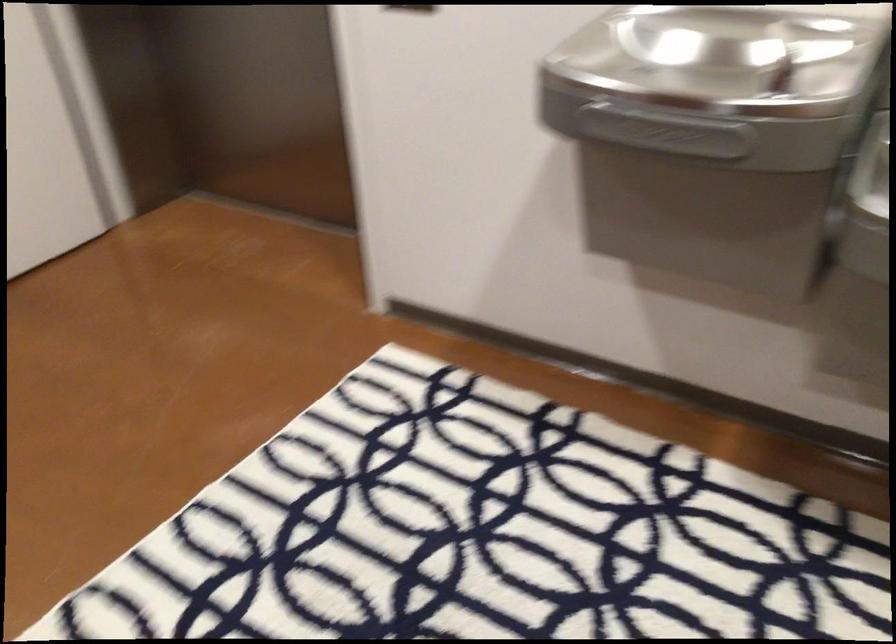
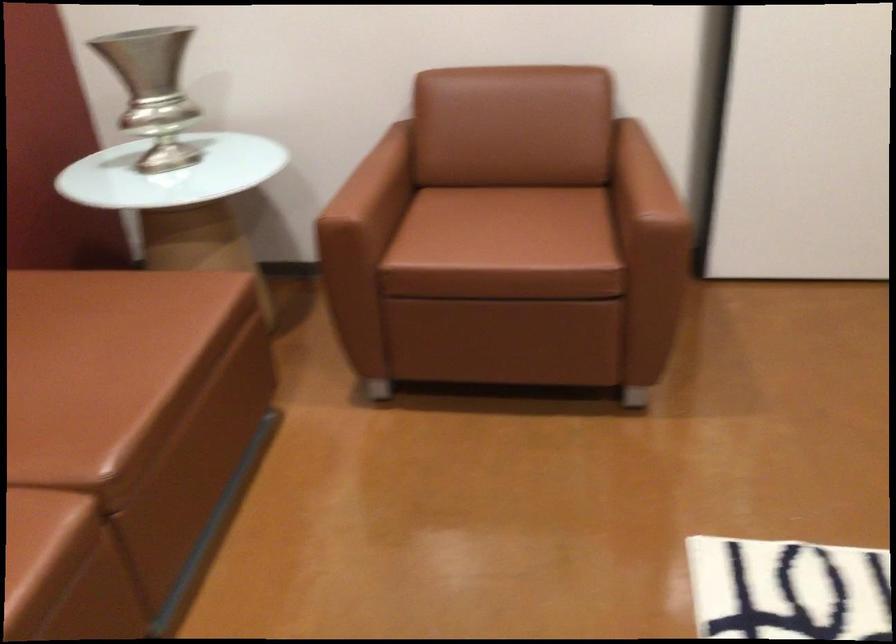
Based on the continuous images, in which direction is the camera rotating?

The rotation direction of the camera is left-down.